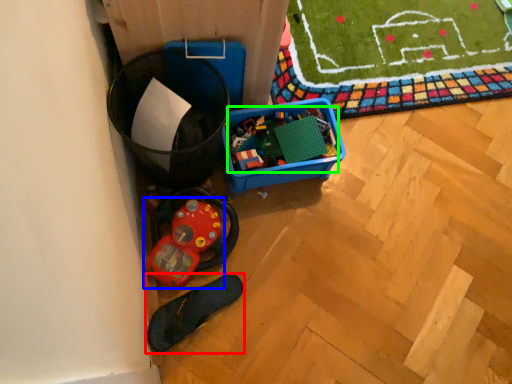
Question: Based on their relative distances, which object is farther from footwear (highlighted by a red box)? Choose from toy (highlighted by a blue box) and toy (highlighted by a green box).

Choices:
 (A) toy
 (B) toy

Answer: (B)